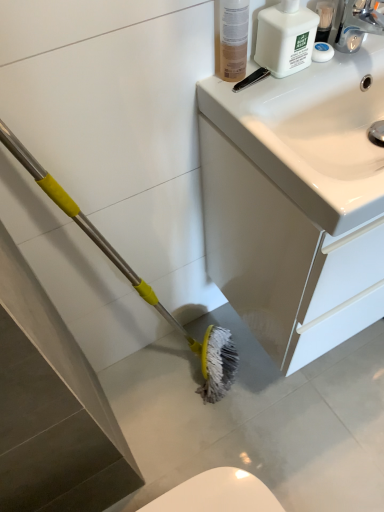
This screenshot has width=384, height=512. I want to click on free space on the front side of translucent plastic bottle at upper right, so click(x=254, y=105).